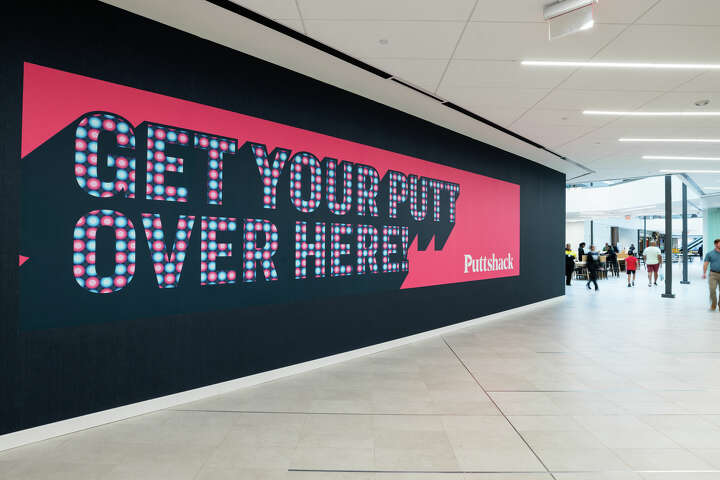
The height and width of the screenshot is (480, 720). Identify the location of tile. (374, 424).